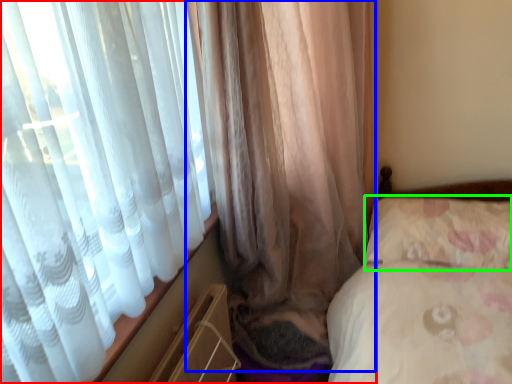
Question: Based on their relative distances, which object is farther from curtain (highlighted by a red box)? Choose from curtain (highlighted by a blue box) and pillow (highlighted by a green box).

Choices:
 (A) curtain
 (B) pillow

Answer: (B)